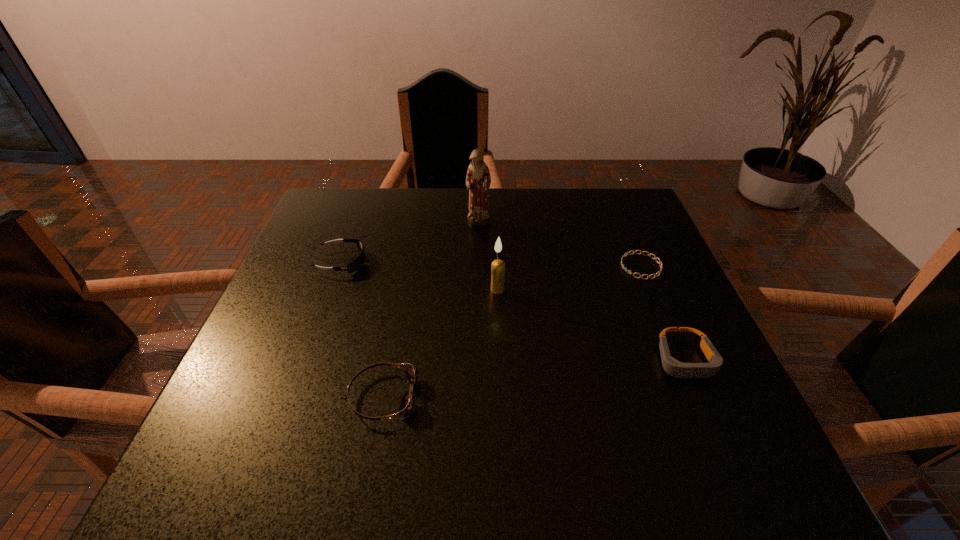
This screenshot has width=960, height=540. Find the location of `free space between the rightmost goggles and the bracelet`. free space between the rightmost goggles and the bracelet is located at coordinates pos(663,313).

Image resolution: width=960 pixels, height=540 pixels. I want to click on vacant space in between the fourth farthest object and the farthest object, so click(x=488, y=256).

At what (x,y) coordinates should I click in order to perform the action: click on vacant region between the rightmost goggles and the second goggles from left to right. Please return your answer as a coordinate pair (x, y). The height and width of the screenshot is (540, 960). Looking at the image, I should click on (534, 378).

Where is `vacant space that's between the second goggles from right to left and the farthest object`? Image resolution: width=960 pixels, height=540 pixels. vacant space that's between the second goggles from right to left and the farthest object is located at coordinates (431, 310).

I want to click on vacant region between the second object from left to right and the shortest object, so click(x=512, y=332).

I want to click on free area in between the leftmost goggles and the fifth object from right to left, so click(363, 329).

Locate an element on the screen. free spot between the rightmost goggles and the fifth shortest object is located at coordinates (591, 325).

Point out which object is positioned as the fifth nearest to the tallest object. Please provide its 2D coordinates. Your answer should be formatted as a tuple, i.e. [(x, y)], where the tuple contains the x and y coordinates of a point satisfying the conditions above.

[(673, 367)]

You are a GUI agent. You are given a task and a screenshot of the screen. Output one action in this format:
    pyautogui.click(x=<x>, y=<y>)
    Task: Click on the object that is the third closest to the farthest goggles
    
    Given the screenshot: What is the action you would take?
    pyautogui.click(x=498, y=266)

Image resolution: width=960 pixels, height=540 pixels. What are the coordinates of `the third closest goggles to the bracelet` in the screenshot? It's located at (357, 263).